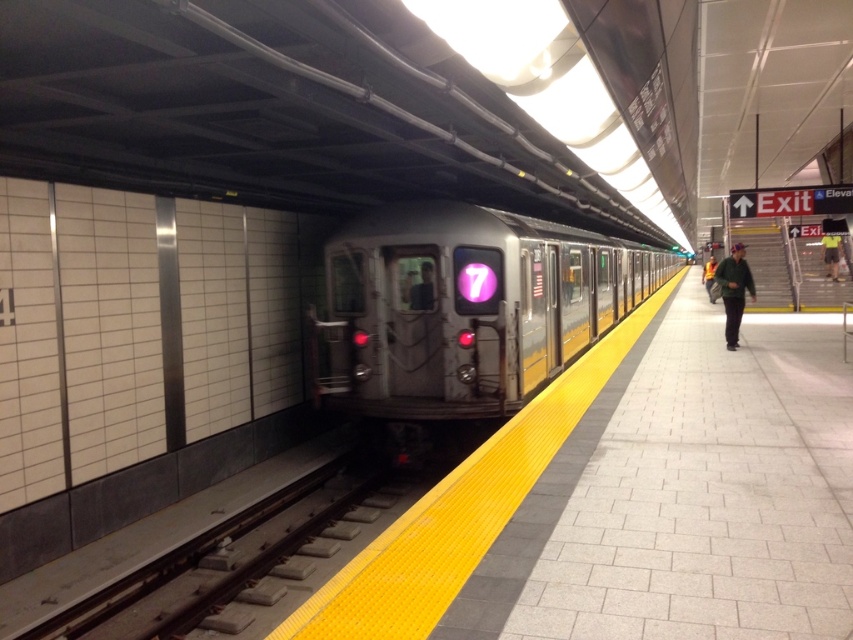
From the picture: Does green fabric jacket at right appear over yellow-cotton shirt at right?

No, green fabric jacket at right is not above yellow-cotton shirt at right.

Is green fabric jacket at right further to camera compared to yellow-cotton shirt at right?

No, it is not.

Who is more forward, (740, 268) or (830, 262)?

Positioned in front is point (740, 268).

Locate an element on the screen. The width and height of the screenshot is (853, 640). green fabric jacket at right is located at coordinates (733, 291).

Is green fabric jacket at right taller than yellow reflective vest at center?

In fact, green fabric jacket at right may be shorter than yellow reflective vest at center.

Who is more distant from viewer, (751, 280) or (711, 259)?

The point (711, 259) is more distant.

Is point (740, 278) more distant than point (712, 269)?

No, (740, 278) is in front of (712, 269).

The width and height of the screenshot is (853, 640). I want to click on green fabric jacket at right, so click(x=733, y=291).

From the picture: Between silver metallic train at center and yellow reflective vest at center, which one has more height?

With more height is silver metallic train at center.

Which is behind, point (416, 282) or point (711, 292)?

Positioned behind is point (711, 292).

Locate an element on the screen. The image size is (853, 640). silver metallic train at center is located at coordinates (465, 307).